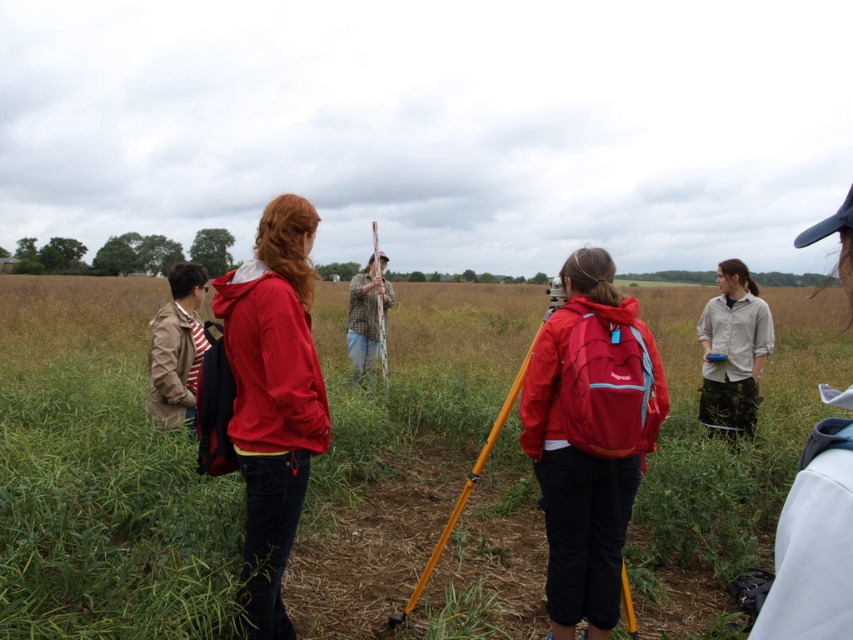
Which is more to the right, matte red jacket at center or striped cotton shirt at left?

matte red jacket at center is more to the right.

You are a GUI agent. You are given a task and a screenshot of the screen. Output one action in this format:
    pyautogui.click(x=<x>, y=<y>)
    Task: Click on the matte red jacket at center
    This screenshot has width=853, height=640.
    Given the screenshot: What is the action you would take?
    pyautogui.click(x=273, y=396)

Which is more to the left, matte red jacket at center or camouflage pants at center?

matte red jacket at center

Does matte red jacket at center have a smaller size compared to camouflage pants at center?

Correct, matte red jacket at center occupies less space than camouflage pants at center.

Which is behind, point (247, 604) or point (730, 273)?

Point (730, 273)

You are a GUI agent. You are given a task and a screenshot of the screen. Output one action in this format:
    pyautogui.click(x=<x>, y=<y>)
    Task: Click on the matte red jacket at center
    
    Given the screenshot: What is the action you would take?
    click(273, 396)

From the picture: Can you confirm if green grass at center is positioned below matte red jacket at center?

No, green grass at center is not below matte red jacket at center.

Measure the distance between point (x=196, y=525) and camera.

Point (x=196, y=525) and camera are 10.39 feet apart.

Locate an element on the screen. This screenshot has height=640, width=853. green grass at center is located at coordinates (102, 476).